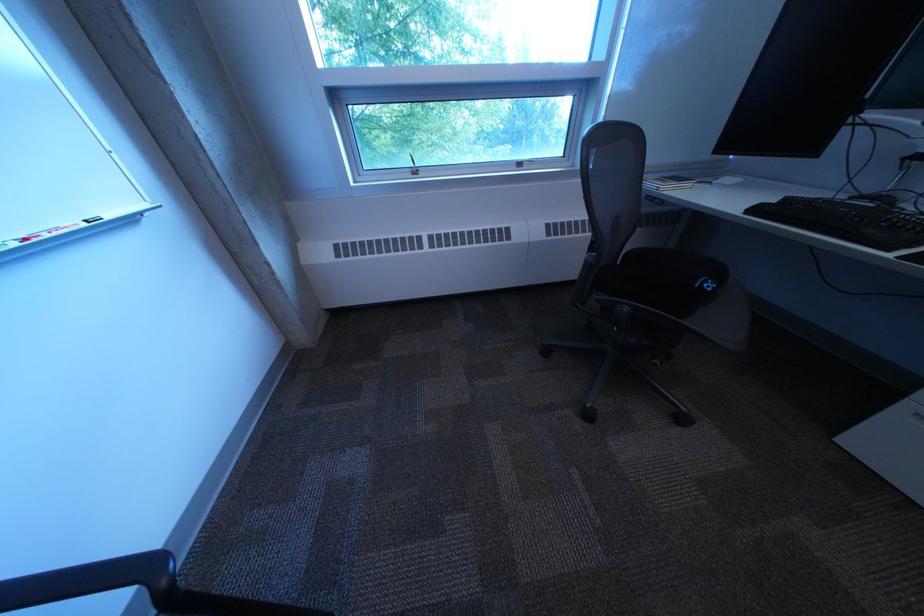
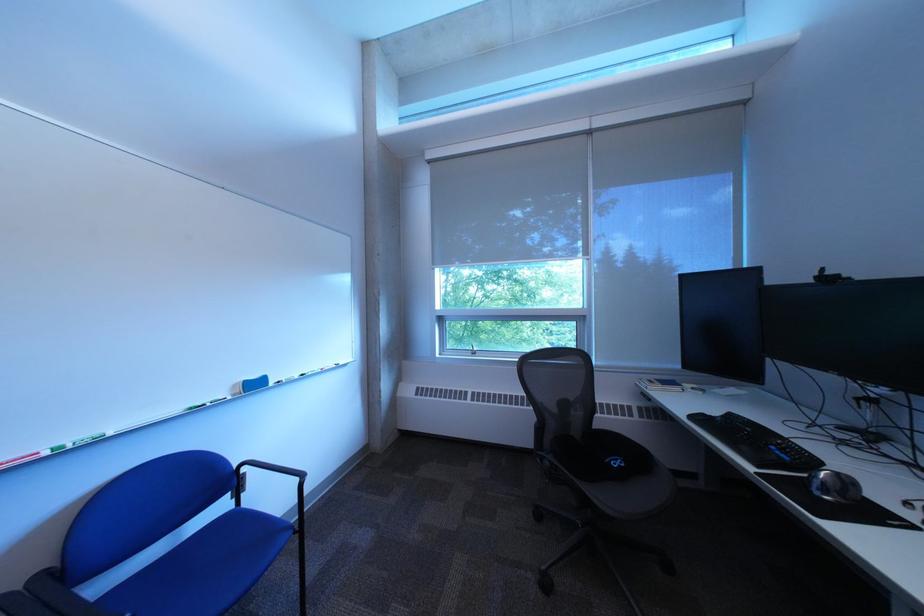
In the second image, find the point that corresponds to (x=767, y=213) in the first image.

(708, 419)